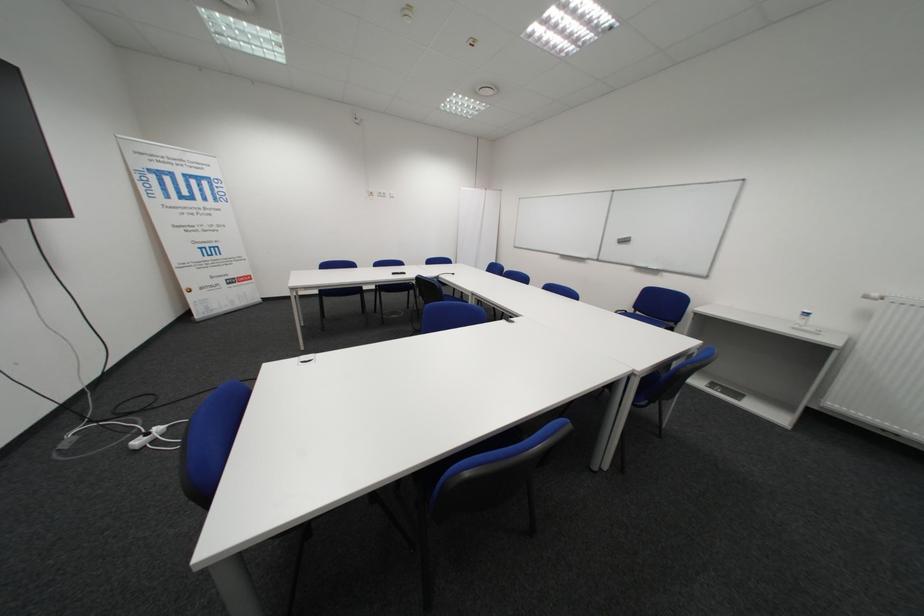
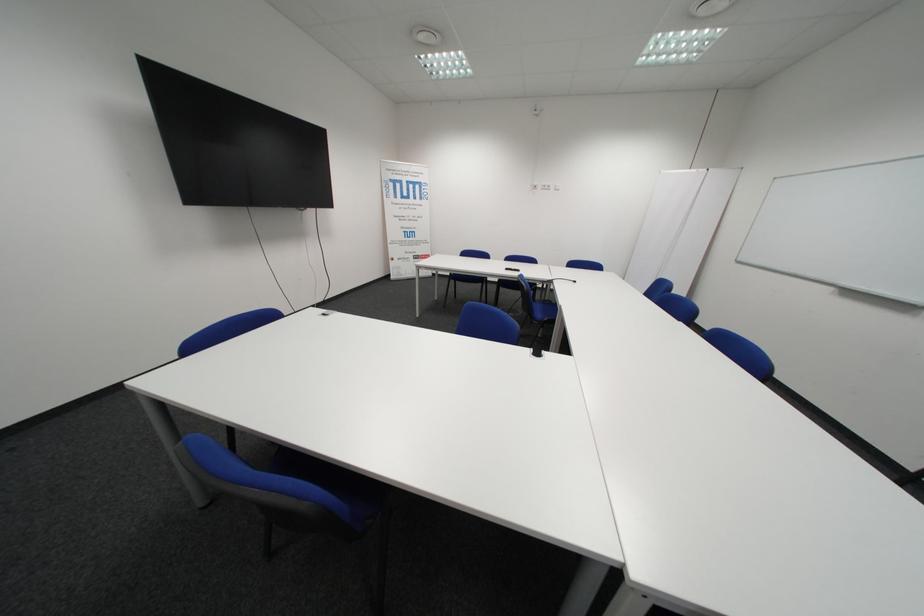
Where in the second image is the point corresponding to (x=406, y=275) from the first image?

(518, 270)